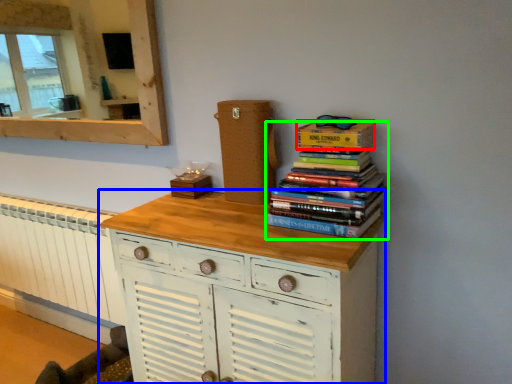
Question: Which object is the farthest from paperback book (highlighted by a red box)? Choose among these: chest of drawers (highlighted by a blue box) or book (highlighted by a green box).

Choices:
 (A) chest of drawers
 (B) book

Answer: (A)